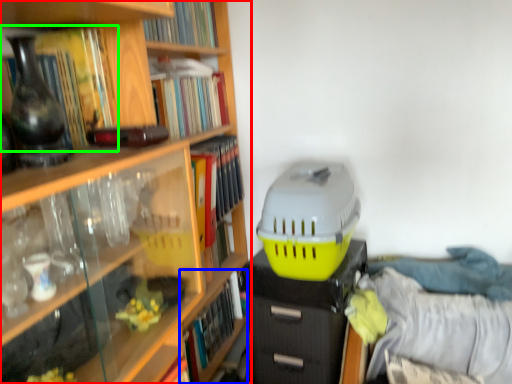
Question: Which object is the farthest from book (highlighted by a red box)? Choose among these: book (highlighted by a blue box) or book (highlighted by a green box).

Choices:
 (A) book
 (B) book

Answer: (A)